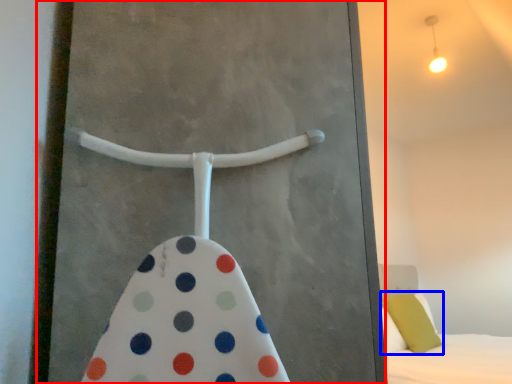
Question: Which point is further to the camera, screen door (highlighted by a red box) or pillow (highlighted by a blue box)?

Choices:
 (A) screen door
 (B) pillow

Answer: (B)